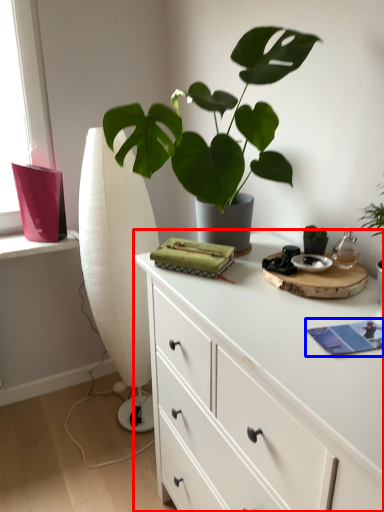
Question: Among these objects, which one is nearest to the camera, chest of drawers (highlighted by a red box) or book (highlighted by a blue box)?

Choices:
 (A) chest of drawers
 (B) book

Answer: (A)